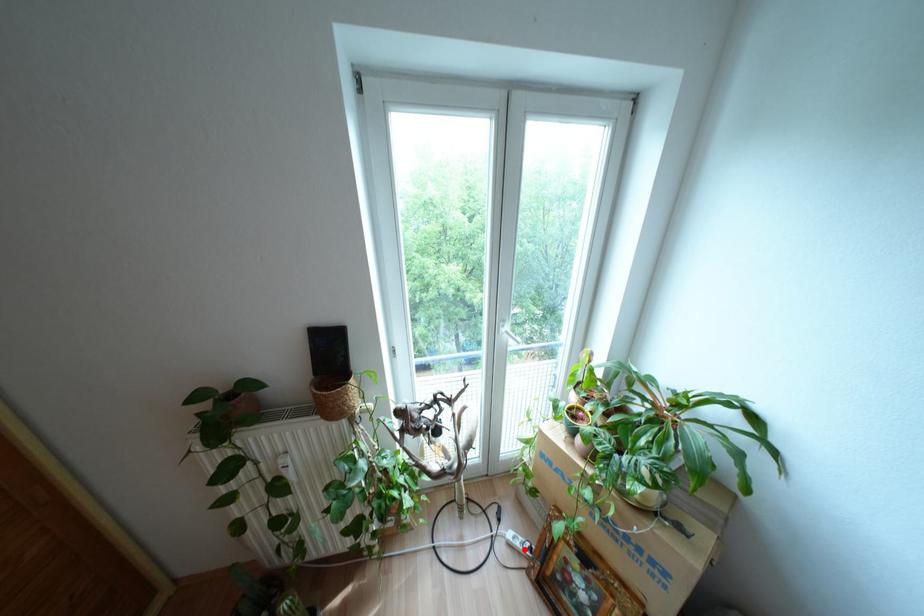
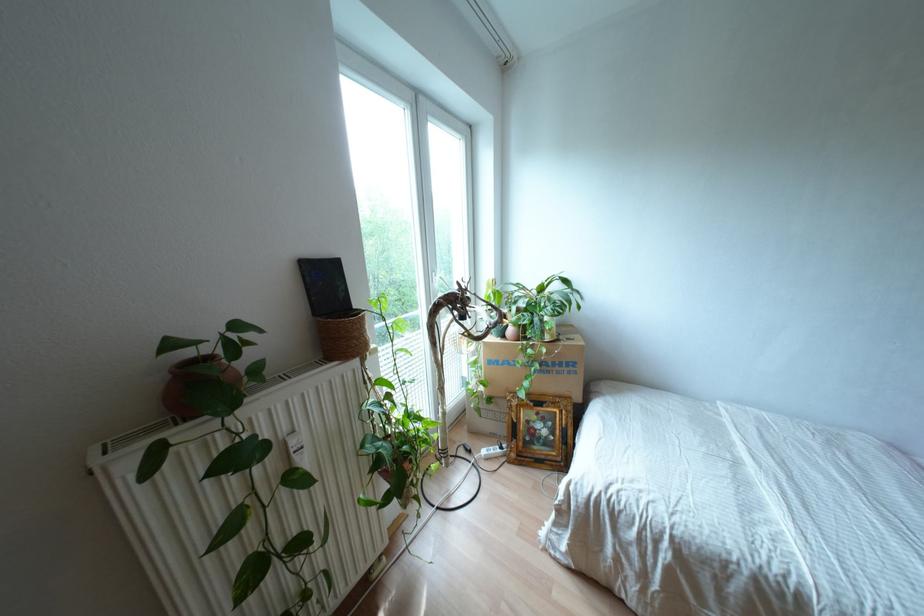
Question: I am providing you with two images of the same scene from different viewpoints. A red point is shown in image1. For the corresponding object point in image2, is it positioned nearer or farther from the camera?

Choices:
 (A) Nearer
 (B) Farther

Answer: (B)